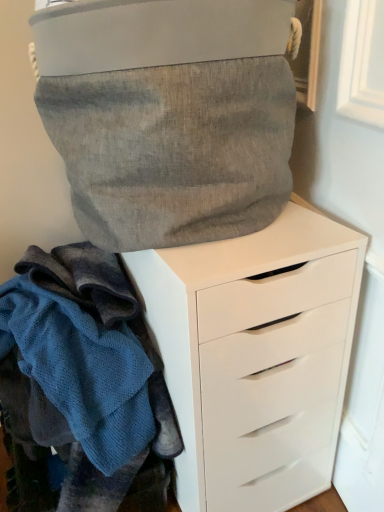
The image size is (384, 512). Identify the location of white matte chest of drawers at center. (255, 356).

Describe the element at coordinates (255, 356) in the screenshot. I see `white matte chest of drawers at center` at that location.

The width and height of the screenshot is (384, 512). Identify the location of white matte chest of drawers at center. (255, 356).